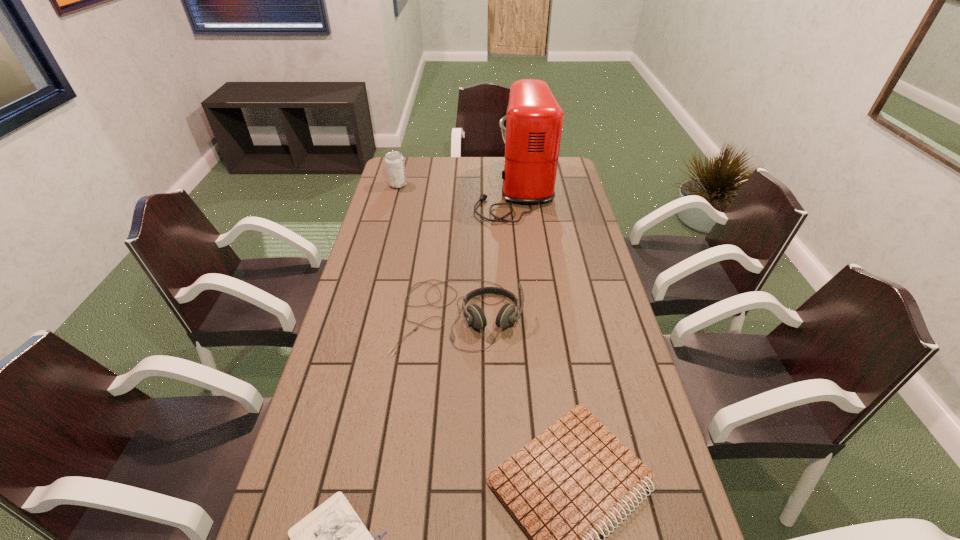
The height and width of the screenshot is (540, 960). Find the location of `kitchen mixer`. kitchen mixer is located at coordinates (531, 130).

This screenshot has width=960, height=540. Find the location of `the second tallest object`. the second tallest object is located at coordinates (395, 168).

The image size is (960, 540). Identify the location of headset. (507, 314).

This screenshot has height=540, width=960. In order to click on the third shortest object in this screenshot , I will do `click(507, 314)`.

The height and width of the screenshot is (540, 960). Identify the location of free spot located on the front-facing side of the kitchen mixer. (430, 190).

This screenshot has width=960, height=540. Identify the location of vacant space situated on the front-facing side of the kitchen mixer. (414, 190).

Locate an element on the screen. The width and height of the screenshot is (960, 540). vacant space located 0.120m on the front-facing side of the kitchen mixer is located at coordinates (446, 190).

At what (x,y) coordinates should I click in order to perform the action: click on vacant space located 0.080m on the front of the fourth shortest object. Please return your answer as a coordinate pair (x, y). Looking at the image, I should click on (394, 199).

The width and height of the screenshot is (960, 540). I want to click on vacant area situated 0.070m on the outer surface of the headset, so click(x=456, y=377).

Identify the location of kitchen mixer present at the far edge. The height and width of the screenshot is (540, 960). (531, 130).